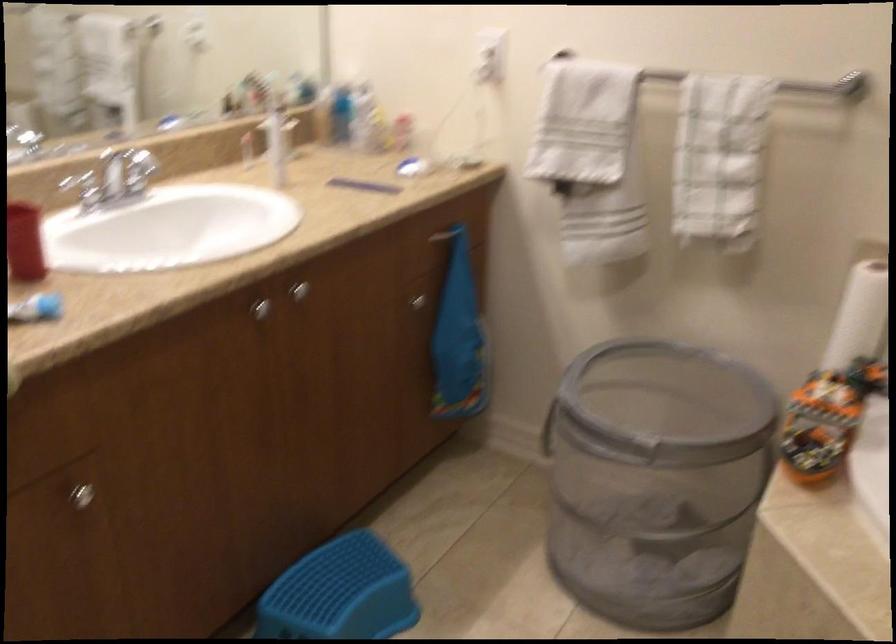
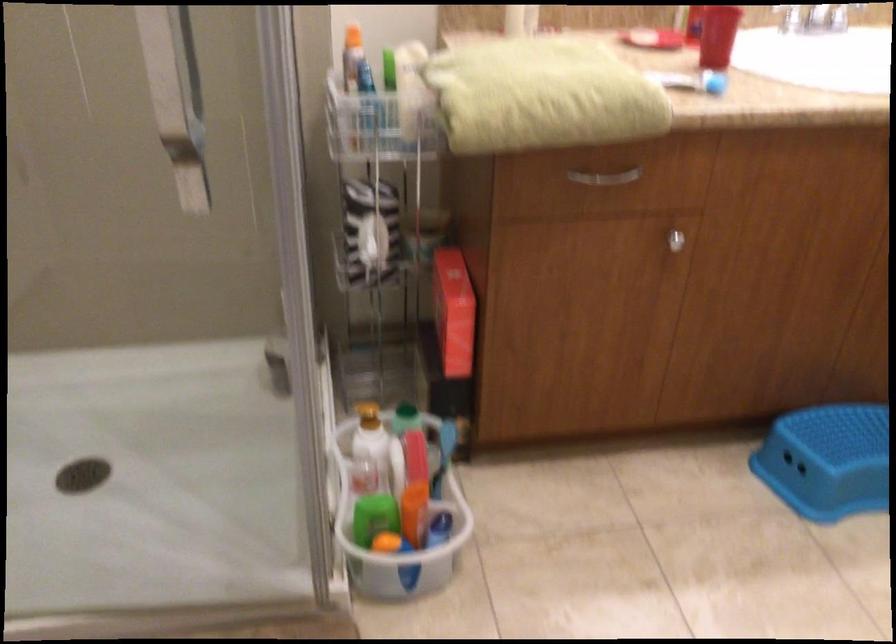
Question: The camera is either moving clockwise (left) or counter-clockwise (right) around the object. The first image is from the beginning of the video and the second image is from the end. Is the camera moving left or right when shooting the video?

Choices:
 (A) Left
 (B) Right

Answer: (B)